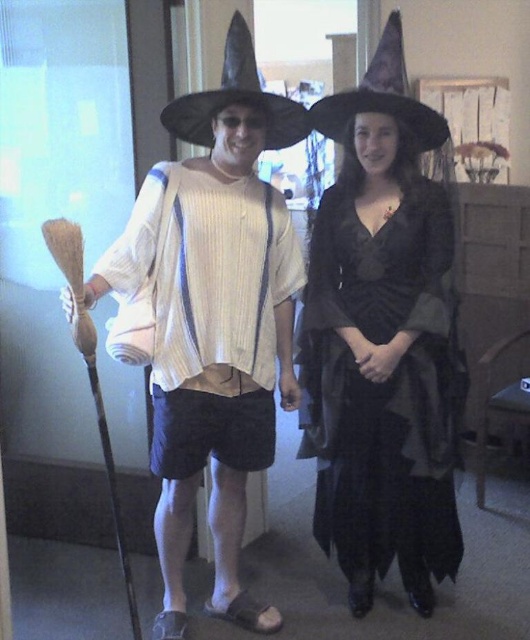
How far apart are black satin dress at center and black felt witch hat at center?

27.71 inches

Who is positioned more to the left, black satin dress at center or black felt witch hat at center?

black felt witch hat at center is more to the left.

Who is more distant from viewer, (x=450, y=468) or (x=278, y=97)?

The point (x=450, y=468) is behind.

Locate an element on the screen. This screenshot has width=530, height=640. black satin dress at center is located at coordinates (384, 385).

Does black felt witch hat at center come behind black felt witch hat at upper center?

No, black felt witch hat at center is closer to the viewer.

Looking at this image, is black felt witch hat at center below black felt witch hat at upper center?

Incorrect, black felt witch hat at center is not positioned below black felt witch hat at upper center.

This screenshot has height=640, width=530. Describe the element at coordinates (236, 99) in the screenshot. I see `black felt witch hat at center` at that location.

The image size is (530, 640). Identify the location of black felt witch hat at center. (236, 99).

Between point (374, 420) and point (384, 99), which one is positioned in front?

Point (384, 99) is in front.

Is point (368, 273) closer to camera compared to point (399, 64)?

No, it is not.

The width and height of the screenshot is (530, 640). What are the coordinates of `black satin dress at center` in the screenshot? It's located at (384, 385).